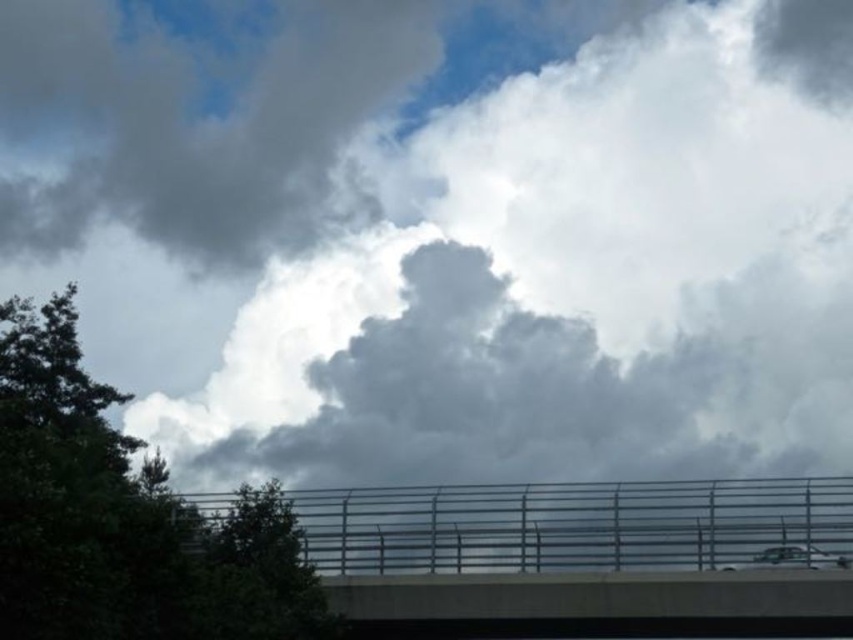
Question: Can you confirm if concrete overpass at center is positioned to the left of green leafy tree at upper left?

Choices:
 (A) no
 (B) yes

Answer: (A)

Question: Among these points, which one is nearest to the camera?

Choices:
 (A) (837, 557)
 (B) (132, 444)

Answer: (A)

Question: Is concrete overpass at center to the left of green leafy tree at upper left from the viewer's perspective?

Choices:
 (A) yes
 (B) no

Answer: (B)

Question: Which point is farther to the camera?

Choices:
 (A) concrete overpass at center
 (B) green leafy tree at upper left

Answer: (A)

Question: Among these objects, which one is farthest from the camera?

Choices:
 (A) green leafy tree at upper left
 (B) concrete overpass at center

Answer: (B)

Question: In this image, where is concrete overpass at center located relative to green leafy tree at upper left?

Choices:
 (A) right
 (B) left

Answer: (A)